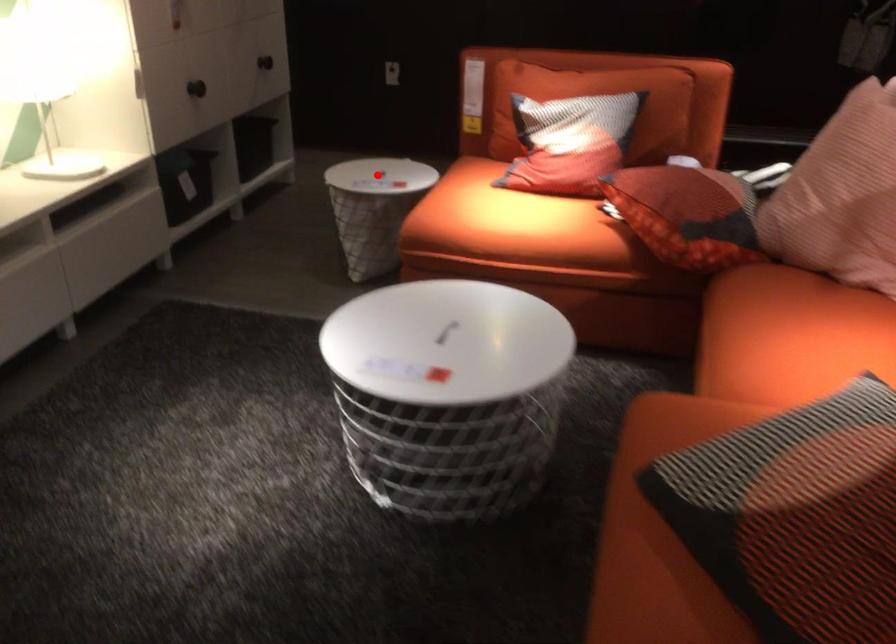
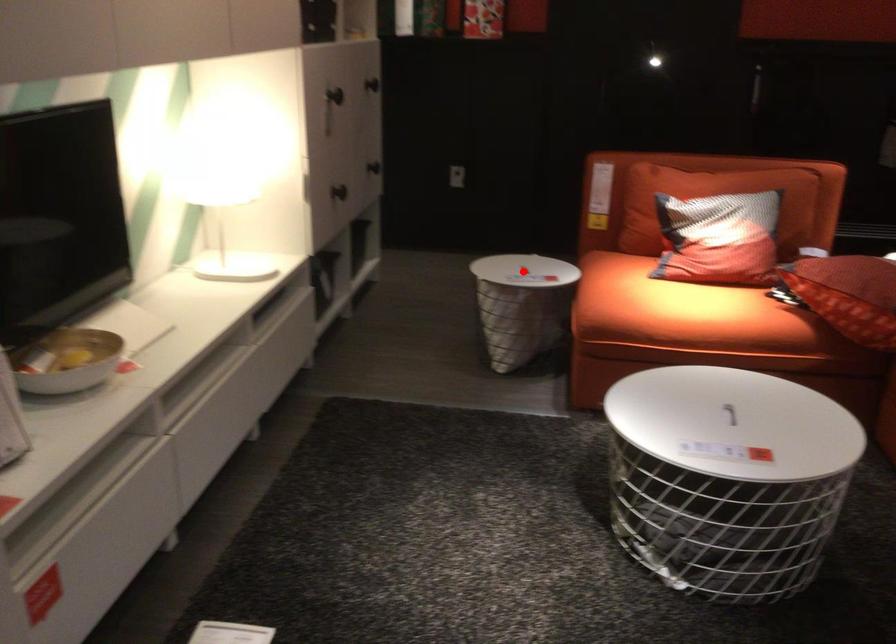
In the scene shown: I am providing you with two images of the same scene from different viewpoints. A red point is marked on the first image and another point is marked on the second image. Is the marked point in image1 the same physical position as the marked point in image2?

Yes